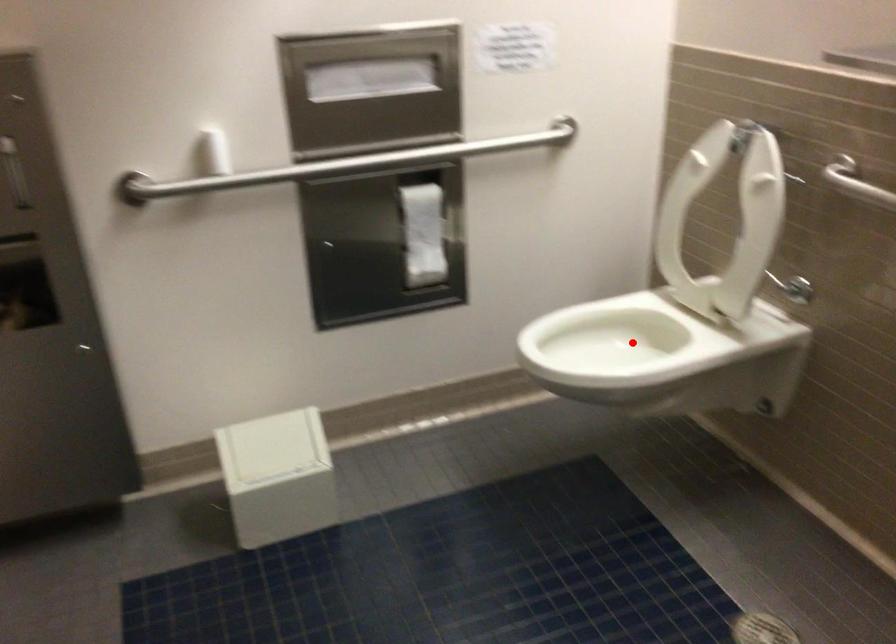
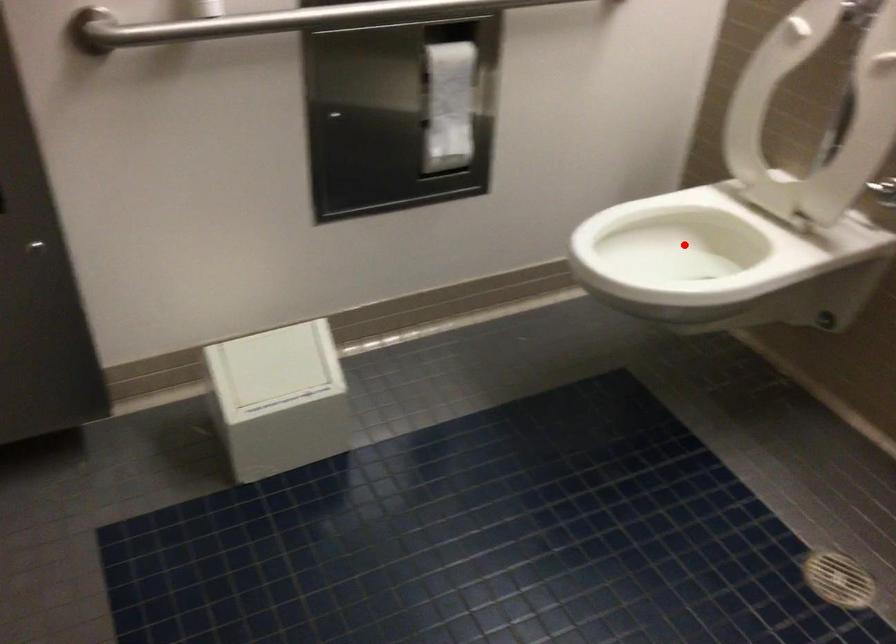
I am providing you with two images of the same scene from different viewpoints. A red point is marked on the first image and another point is marked on the second image. Is the red point in image1 aligned with the point shown in image2?

Yes